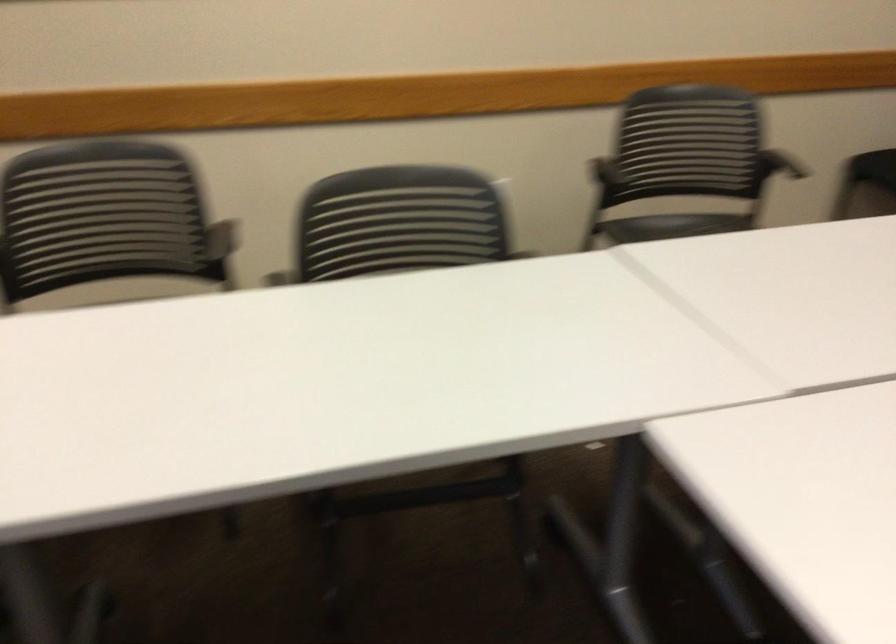
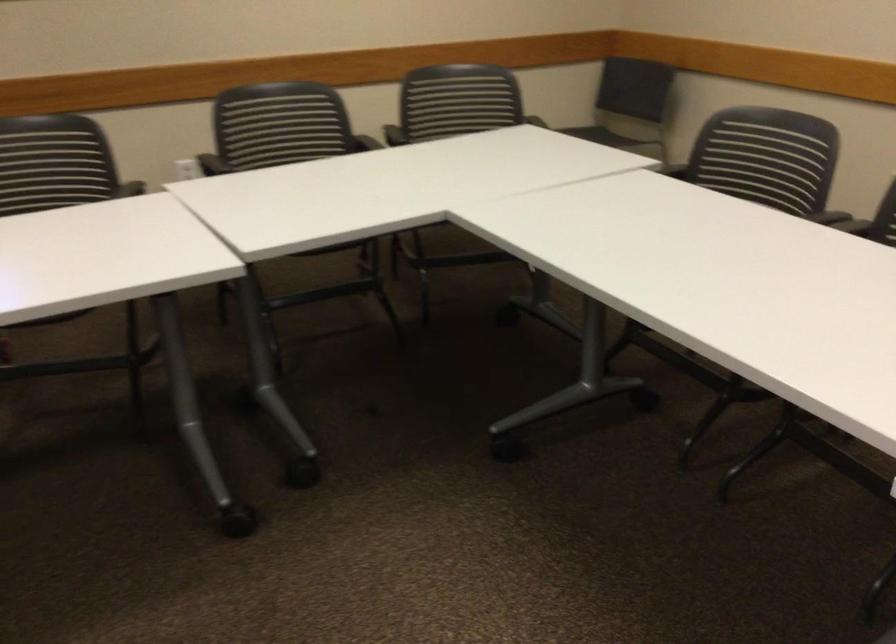
Looking at this image, first-person continuous shooting, in which direction is the camera rotating?

The rotation direction of the camera is left-down.